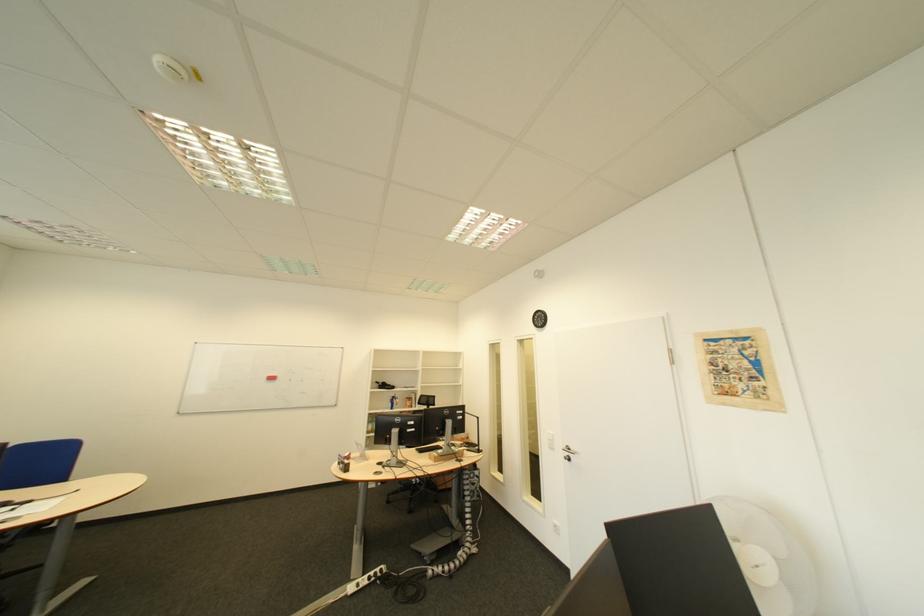
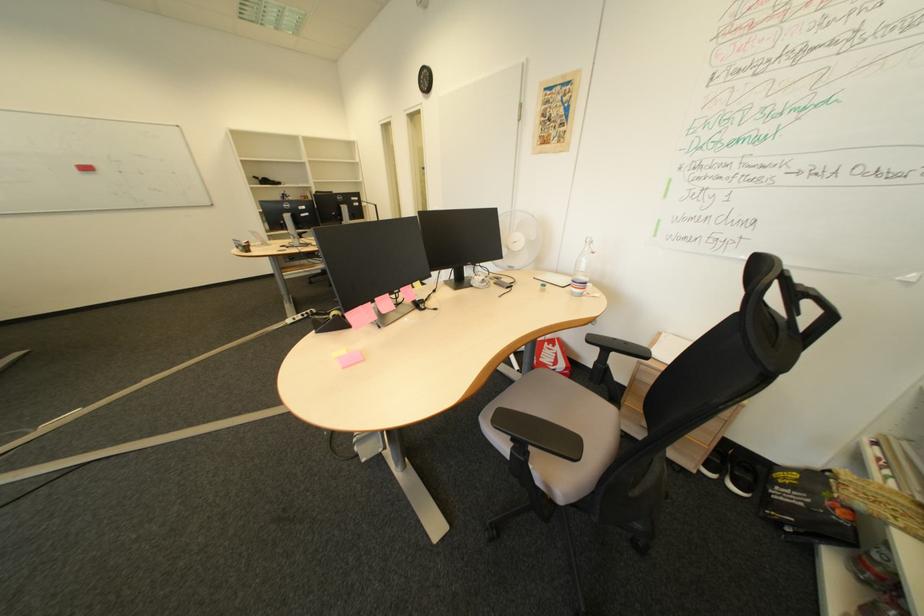
Where in the second image is the point corresponding to (x=398, y=464) from the first image?

(301, 246)